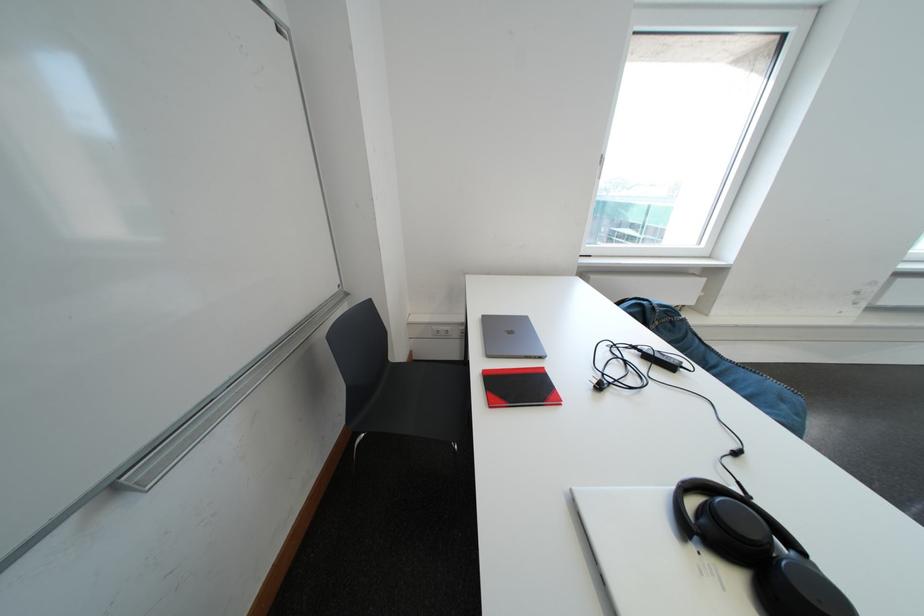
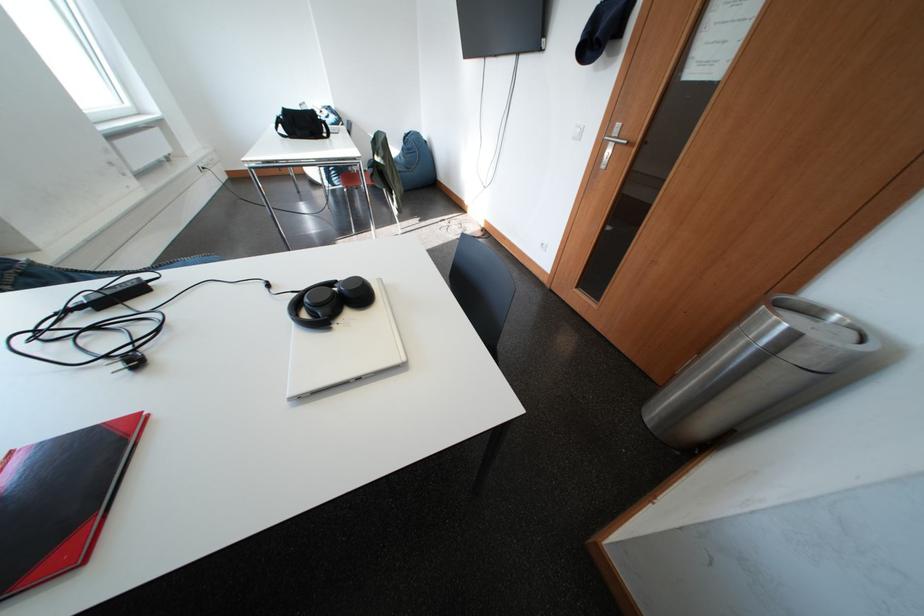
In the second image, find the point that corresponds to (750,487) in the first image.

(304, 294)